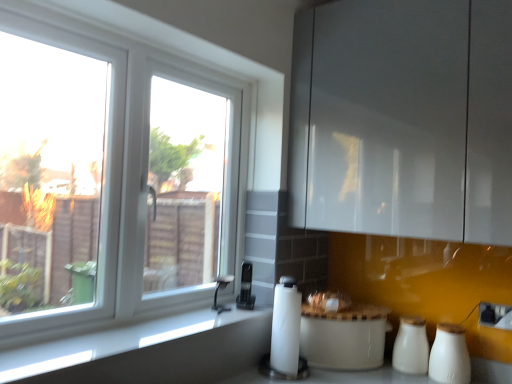
The image size is (512, 384). Identify the location of free spot above white glossy rice cooker at center, marked as the second appliance in a left-to-right arrangement (from a real-world perspective). (324, 302).